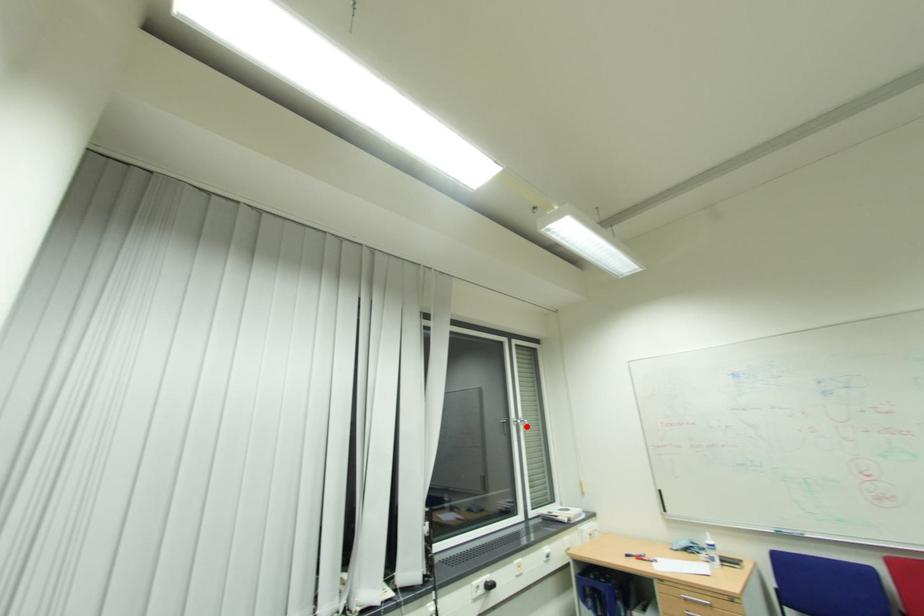
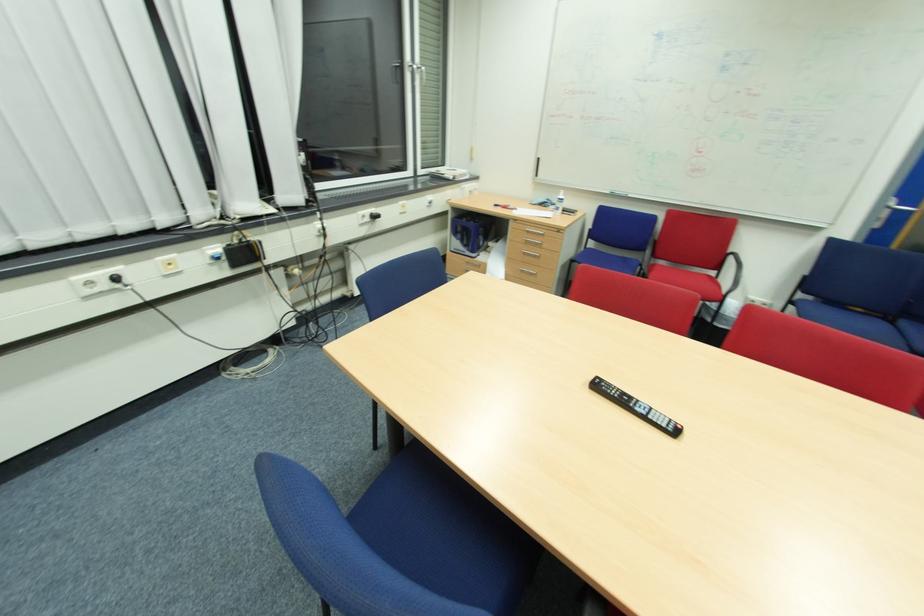
Where in the second image is the point corresponding to the highlighted location from the first image?

(427, 78)